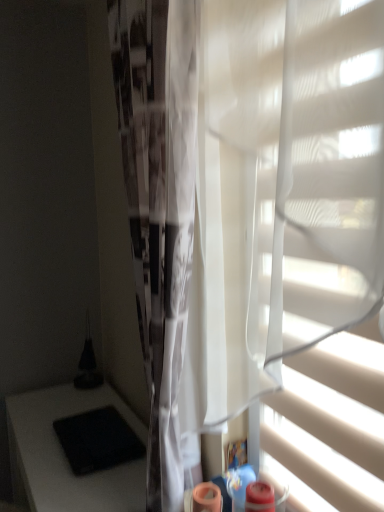
At what (x,y) coordinates should I click in order to perform the action: click on unoccupied space behind black matte pad at lower left. Please return your answer as a coordinate pair (x, y). This screenshot has width=384, height=512. Looking at the image, I should click on (96, 402).